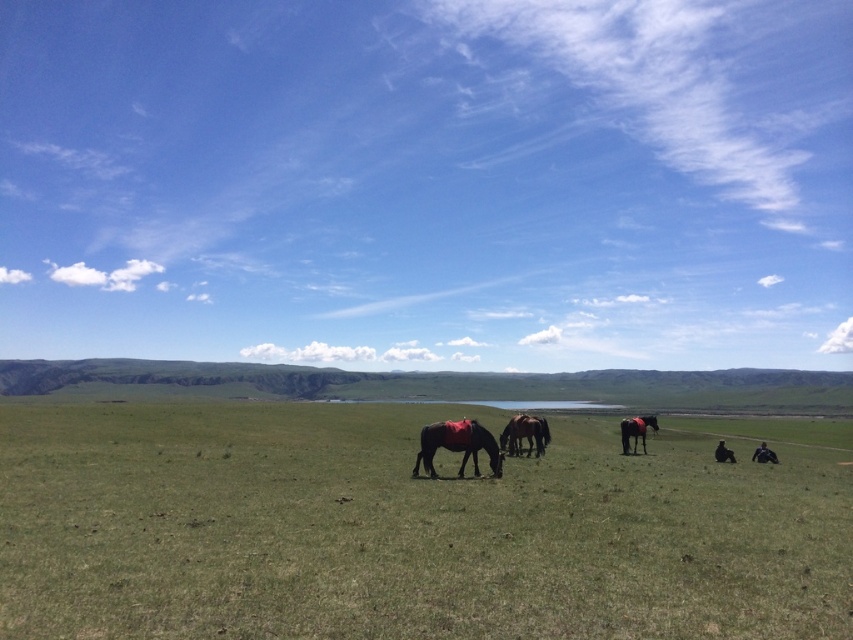
Question: Which of the following is the farthest from the observer?

Choices:
 (A) (631, 417)
 (B) (527, 440)
 (C) (439, 442)

Answer: (A)

Question: Among these objects, which one is farthest from the camera?

Choices:
 (A) dark brown glossy horse at center
 (B) shiny black horse at center
 (C) shiny brown horse at lower right

Answer: (C)

Question: Does shiny black horse at center appear over dark brown glossy horse at center?

Choices:
 (A) yes
 (B) no

Answer: (A)

Question: Does green grass pasture at center have a greater width compared to dark brown glossy horse at center?

Choices:
 (A) yes
 (B) no

Answer: (A)

Question: Based on their relative distances, which object is farther from the green grass pasture at center?

Choices:
 (A) shiny brown horse at lower right
 (B) dark brown glossy horse at center
 (C) shiny black horse at center

Answer: (A)

Question: Is green grass pasture at center to the right of shiny brown horse at lower right from the viewer's perspective?

Choices:
 (A) yes
 (B) no

Answer: (B)